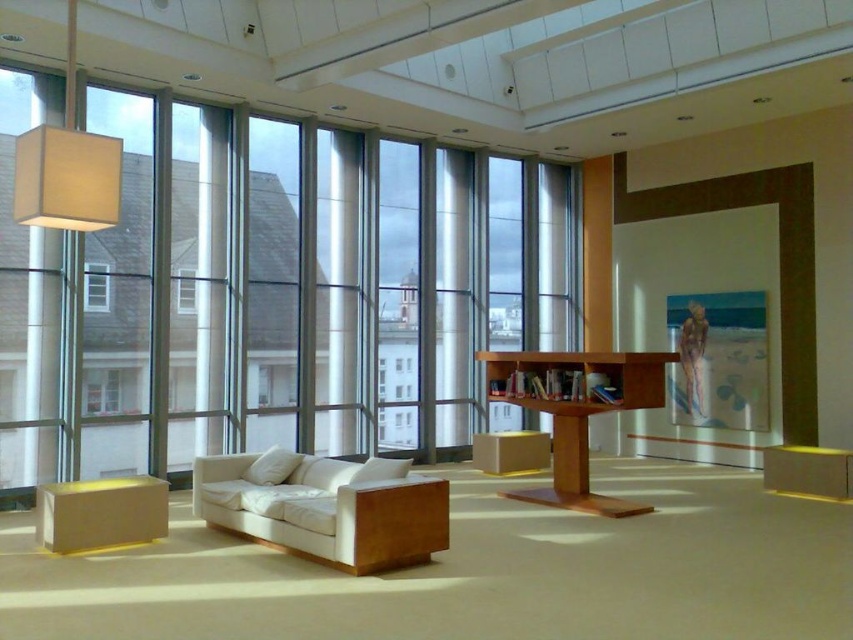
Does light brown wooden bookshelf at center have a greater width compared to matte white coffee table at lower left?

Yes.

Is light brown wooden bookshelf at center bigger than matte white coffee table at lower left?

Yes.

Which is behind, point (616, 362) or point (132, 480)?

Point (616, 362)

You are a GUI agent. You are given a task and a screenshot of the screen. Output one action in this format:
    pyautogui.click(x=<x>, y=<y>)
    Task: Click on the light brown wooden bookshelf at center
    This screenshot has width=853, height=640.
    Given the screenshot: What is the action you would take?
    pyautogui.click(x=576, y=410)

Does white leather couch at center appear on the right side of matte white coffee table at lower left?

Correct, you'll find white leather couch at center to the right of matte white coffee table at lower left.

This screenshot has height=640, width=853. Describe the element at coordinates (326, 506) in the screenshot. I see `white leather couch at center` at that location.

This screenshot has width=853, height=640. Find the location of `white leather couch at center`. white leather couch at center is located at coordinates (326, 506).

Does matte white coffee table at lower left lie behind clear glass window at center?

That is False.

Is point (103, 508) farther from camera compared to point (184, 284)?

No.

The height and width of the screenshot is (640, 853). What do you see at coordinates (100, 513) in the screenshot? I see `matte white coffee table at lower left` at bounding box center [100, 513].

Image resolution: width=853 pixels, height=640 pixels. In order to click on matte white coffee table at lower left in this screenshot , I will do `click(100, 513)`.